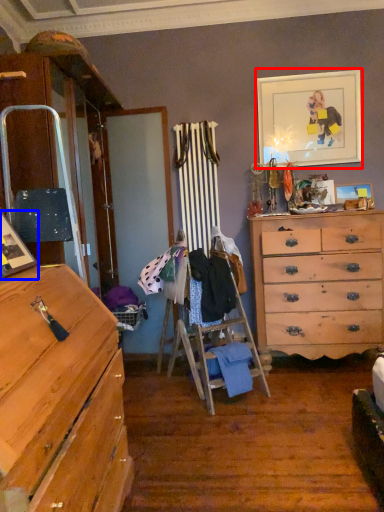
Question: Which point is further to the camera, picture frame (highlighted by a red box) or picture frame (highlighted by a blue box)?

Choices:
 (A) picture frame
 (B) picture frame

Answer: (A)